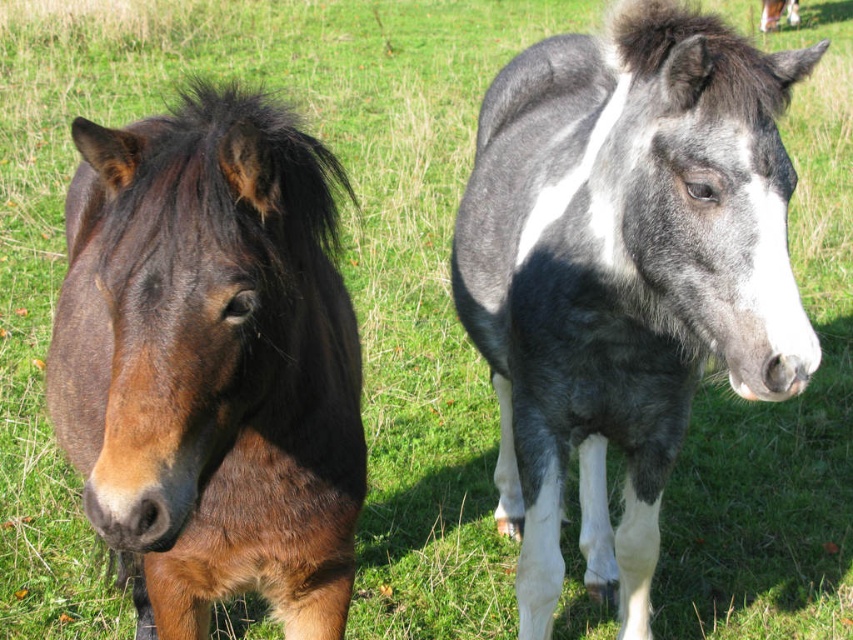
Between speckled gray horse at center and brown glossy horse at center, which one has less height?

Standing shorter between the two is brown glossy horse at center.

Is speckled gray horse at center above brown glossy horse at center?

Correct, speckled gray horse at center is located above brown glossy horse at center.

Does point (524, 172) lie behind point (349, 547)?

Yes, point (524, 172) is behind point (349, 547).

Identify the location of speckled gray horse at center. (624, 273).

Does brown glossy horse at center have a greater width compared to white glossy horse at upper right?

Yes, brown glossy horse at center is wider than white glossy horse at upper right.

Which is behind, point (248, 129) or point (779, 1)?

The point (779, 1) is behind.

This screenshot has width=853, height=640. In order to click on brown glossy horse at center in this screenshot , I will do `click(212, 364)`.

Who is lower down, speckled gray horse at center or white glossy horse at upper right?

speckled gray horse at center is lower down.

Who is positioned more to the right, speckled gray horse at center or white glossy horse at upper right?

white glossy horse at upper right is more to the right.

Is point (607, 237) positioned after point (773, 10)?

No, it is in front of (773, 10).

This screenshot has width=853, height=640. Identify the location of speckled gray horse at center. (624, 273).